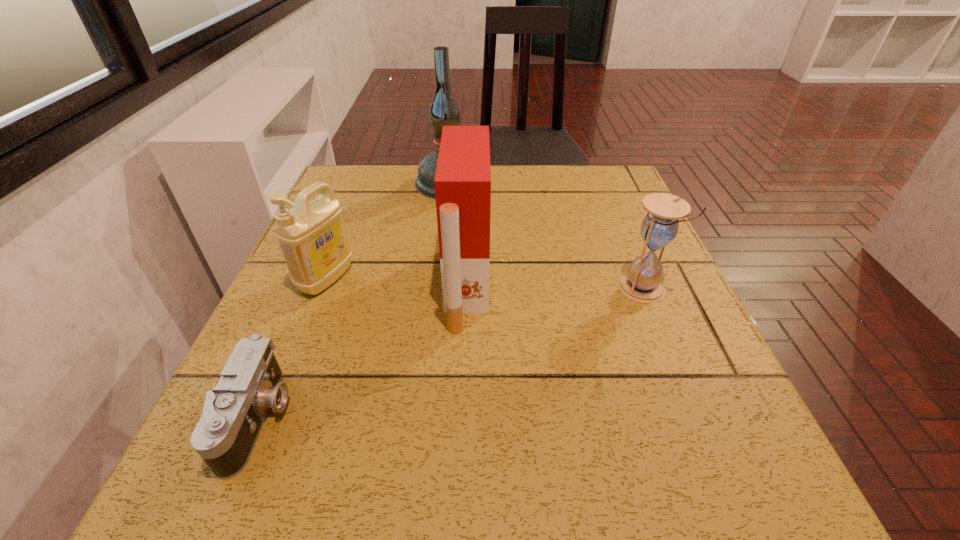
This screenshot has width=960, height=540. Identify the location of oil lamp. (444, 111).

I want to click on the tallest object, so click(x=444, y=111).

Image resolution: width=960 pixels, height=540 pixels. In order to click on the second tallest object in this screenshot , I will do `click(462, 181)`.

This screenshot has height=540, width=960. I want to click on detergent, so click(x=312, y=236).

Where is `hourglass`? This screenshot has height=540, width=960. hourglass is located at coordinates (642, 283).

Image resolution: width=960 pixels, height=540 pixels. Find the location of `camera`. camera is located at coordinates (233, 414).

At what (x,y) coordinates should I click in order to perform the action: click on the nearest object. Please return your answer as a coordinate pair (x, y). Looking at the image, I should click on (233, 414).

I want to click on free space located 0.060m on the left of the farthest object, so click(392, 184).

Image resolution: width=960 pixels, height=540 pixels. In order to click on vacant region located on the front-facing side of the fourth shortest object in this screenshot , I will do `click(623, 286)`.

The width and height of the screenshot is (960, 540). I want to click on blank space located on the front of the detergent, so click(264, 436).